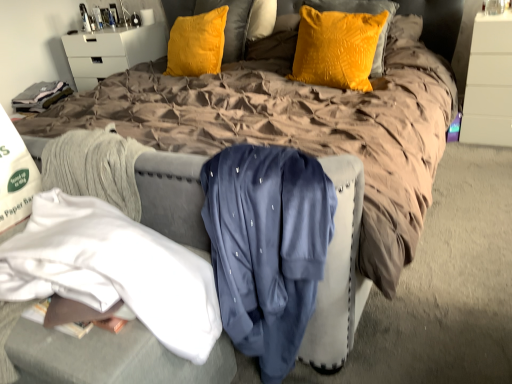
Question: Does white glossy dresser at upper right have a lesser height compared to velvet yellow pillow at center, which is the second pillow from right to left?

Choices:
 (A) yes
 (B) no

Answer: (B)

Question: Is the position of white glossy dresser at upper right less distant than that of velvet yellow pillow at center, which is the first pillow from back to front?

Choices:
 (A) yes
 (B) no

Answer: (A)

Question: Is white glossy dresser at upper right at the left side of velvet yellow pillow at center, which is the first pillow from back to front?

Choices:
 (A) yes
 (B) no

Answer: (B)

Question: From the image's perspective, is white glossy dresser at upper right under velvet yellow pillow at center, the first pillow viewed from the left?

Choices:
 (A) yes
 (B) no

Answer: (A)

Question: From the image's perspective, would you say white glossy dresser at upper right is positioned over velvet yellow pillow at center, the first pillow viewed from the left?

Choices:
 (A) no
 (B) yes

Answer: (A)

Question: From a real-world perspective, is brown quilted bed at center above or below white glossy nightstand at upper left?

Choices:
 (A) above
 (B) below

Answer: (A)

Question: Which is correct: brown quilted bed at center is inside white glossy nightstand at upper left, or outside of it?

Choices:
 (A) inside
 (B) outside

Answer: (B)

Question: From the image's perspective, relative to white glossy nightstand at upper left, is brown quilted bed at center above or below?

Choices:
 (A) above
 (B) below

Answer: (B)

Question: Considering the positions of brown quilted bed at center and white glossy nightstand at upper left in the image, is brown quilted bed at center taller or shorter than white glossy nightstand at upper left?

Choices:
 (A) tall
 (B) short

Answer: (A)

Question: Considering the relative positions of velvet yellow pillow at center, the first pillow viewed from the left, and navy blue satin shirt at center, which is the 2th clothing from left to right, in the image provided, is velvet yellow pillow at center, the first pillow viewed from the left, to the left or to the right of navy blue satin shirt at center, which is the 2th clothing from left to right,?

Choices:
 (A) left
 (B) right

Answer: (A)

Question: Is velvet yellow pillow at center, which is the second pillow from right to left, in front of or behind navy blue satin shirt at center, which is the 2th clothing from left to right, in the image?

Choices:
 (A) front
 (B) behind

Answer: (B)

Question: In terms of height, does velvet yellow pillow at center, the first pillow viewed from the left, look taller or shorter compared to navy blue satin shirt at center, which appears as the first clothing when viewed from the right?

Choices:
 (A) tall
 (B) short

Answer: (B)

Question: In terms of width, does velvet yellow pillow at center, the first pillow viewed from the left, look wider or thinner when compared to navy blue satin shirt at center, which appears as the first clothing when viewed from the right?

Choices:
 (A) wide
 (B) thin

Answer: (B)

Question: In terms of height, does white glossy nightstand at upper left look taller or shorter compared to white fabric at lower left, the 2th clothing positioned from the right?

Choices:
 (A) tall
 (B) short

Answer: (A)

Question: From the image's perspective, is white glossy nightstand at upper left positioned above or below white fabric at lower left, which ranks as the 1th clothing in left-to-right order?

Choices:
 (A) above
 (B) below

Answer: (A)